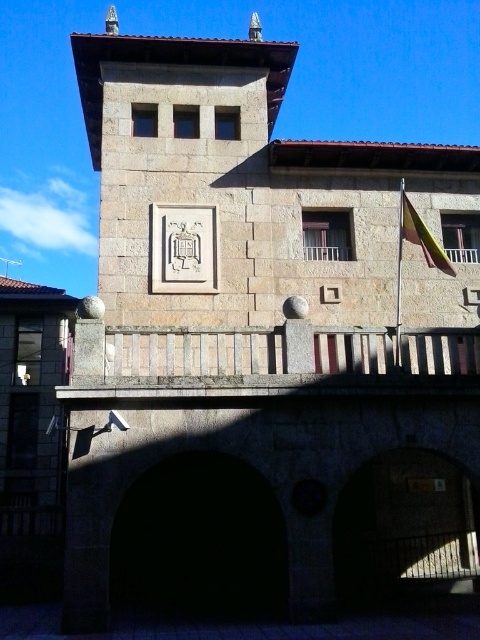
Question: Can you confirm if white stone clock at center is positioned to the right of yellow fabric flag at upper right?

Choices:
 (A) yes
 (B) no

Answer: (B)

Question: Which point appears closest to the camera in this image?

Choices:
 (A) (434, 259)
 (B) (184, 253)

Answer: (A)

Question: Can you confirm if white stone clock at center is bigger than yellow fabric flag at upper right?

Choices:
 (A) no
 (B) yes

Answer: (B)

Question: Which point is closer to the camera?

Choices:
 (A) yellow fabric flag at upper right
 (B) white stone clock at center

Answer: (A)

Question: Which point appears closest to the camera in this image?

Choices:
 (A) (452, 275)
 (B) (177, 225)

Answer: (A)

Question: Does white stone clock at center lie in front of yellow fabric flag at upper right?

Choices:
 (A) yes
 (B) no

Answer: (B)